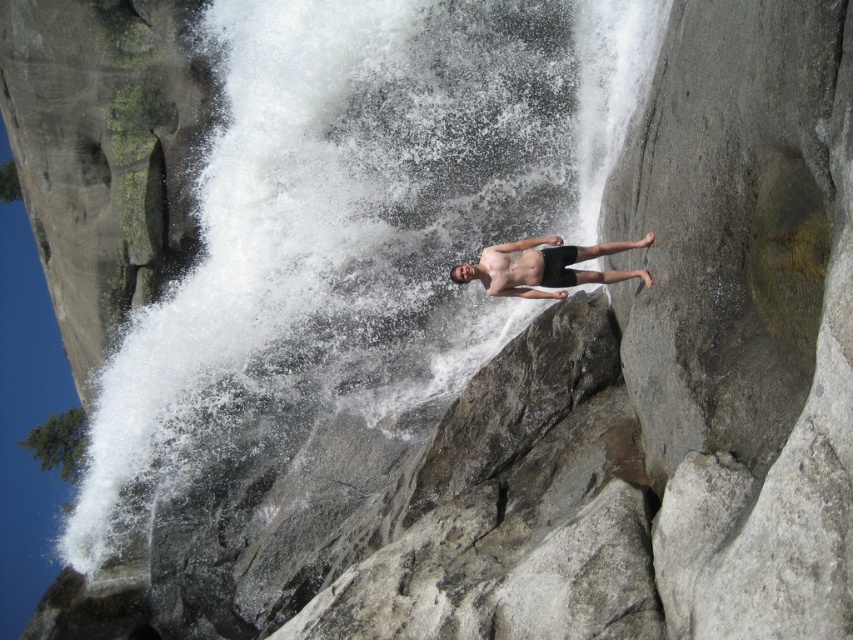
Question: Which point appears closest to the camera in this image?

Choices:
 (A) (524, 241)
 (B) (410, 19)

Answer: (A)

Question: Can you confirm if white frothy water at center is positioned below smooth black shorts at center?

Choices:
 (A) yes
 (B) no

Answer: (B)

Question: Is white frothy water at center thinner than smooth black shorts at center?

Choices:
 (A) no
 (B) yes

Answer: (A)

Question: Among these objects, which one is nearest to the camera?

Choices:
 (A) white frothy water at center
 (B) smooth black shorts at center

Answer: (B)

Question: Is white frothy water at center thinner than smooth black shorts at center?

Choices:
 (A) no
 (B) yes

Answer: (A)